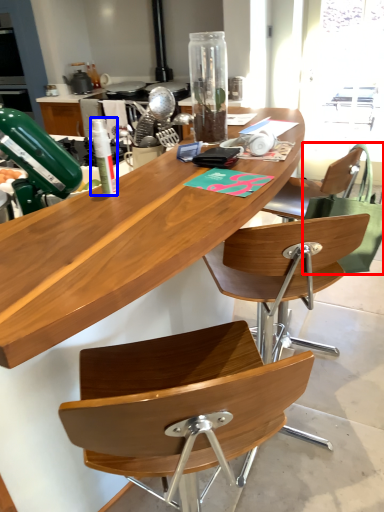
Question: Which point is further to the camera, handbag (highlighted by a red box) or bottle (highlighted by a blue box)?

Choices:
 (A) handbag
 (B) bottle

Answer: (A)